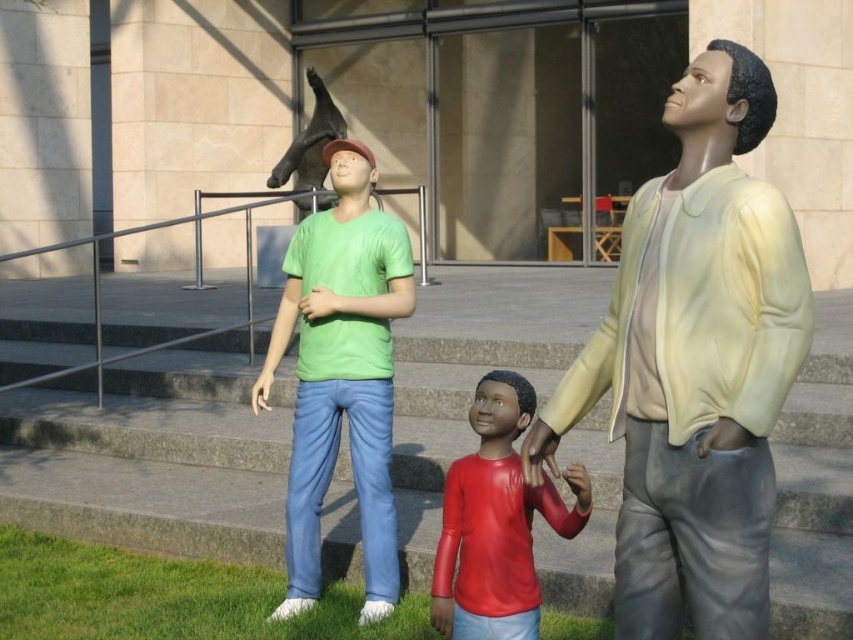
Is matte green t-shirt at center bigger than matte red hand at center?

Yes.

Identify the location of matte green t-shirt at center. The image size is (853, 640). (341, 374).

Image resolution: width=853 pixels, height=640 pixels. What are the coordinates of `matte green t-shirt at center` in the screenshot? It's located at (341, 374).

Who is lower down, rubberized red shirt at center or matte red hand at lower center?

Positioned lower is rubberized red shirt at center.

Based on the photo, who is shorter, rubberized red shirt at center or matte red hand at lower center?

With less height is matte red hand at lower center.

This screenshot has height=640, width=853. Identify the location of rubberized red shirt at center. (492, 524).

Who is positioned more to the right, rubberized red shirt at center or matte red hand at center?

matte red hand at center is more to the right.

What do you see at coordinates (492, 524) in the screenshot?
I see `rubberized red shirt at center` at bounding box center [492, 524].

Between point (500, 564) and point (552, 472), which one is positioned behind?

Positioned behind is point (500, 564).

This screenshot has height=640, width=853. In order to click on rubberized red shirt at center in this screenshot , I will do `click(492, 524)`.